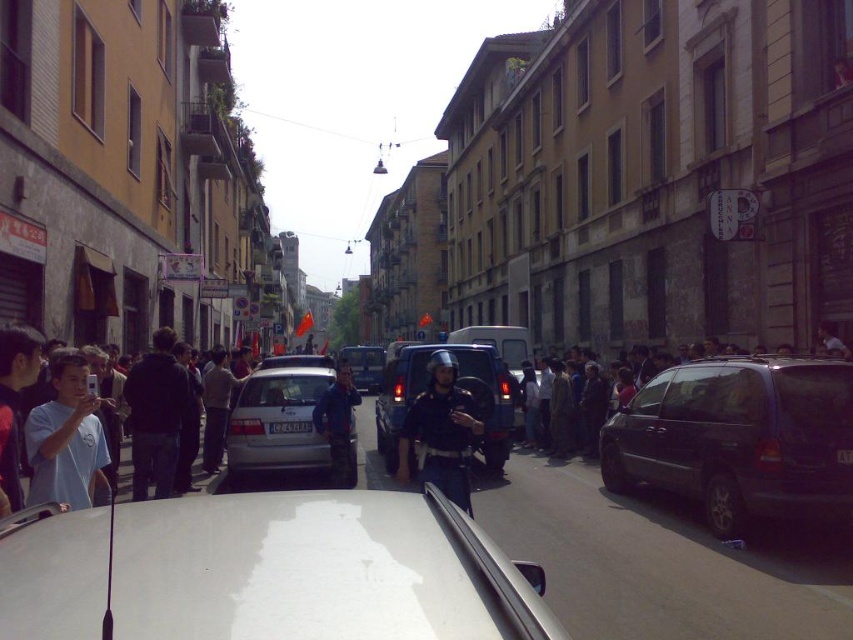
You are a drone operator trying to capture a photo of two specific points on the street. The first point is at coordinate point(398, 362) and the second is at point(206, 378). Since you want the closer point to be in focus, which point should you prioritize focusing on?

Point(398, 362) is closer to the camera than point(206, 378), so you should prioritize focusing on point(398, 362) to ensure it is in focus.

You are a pedestrian standing on the sidewalk. You see a white glossy car at center and a light blue shirt at left. Which object is closer to you?

The light blue shirt at left is closer to you because the white glossy car at center is below it, indicating it is further away.